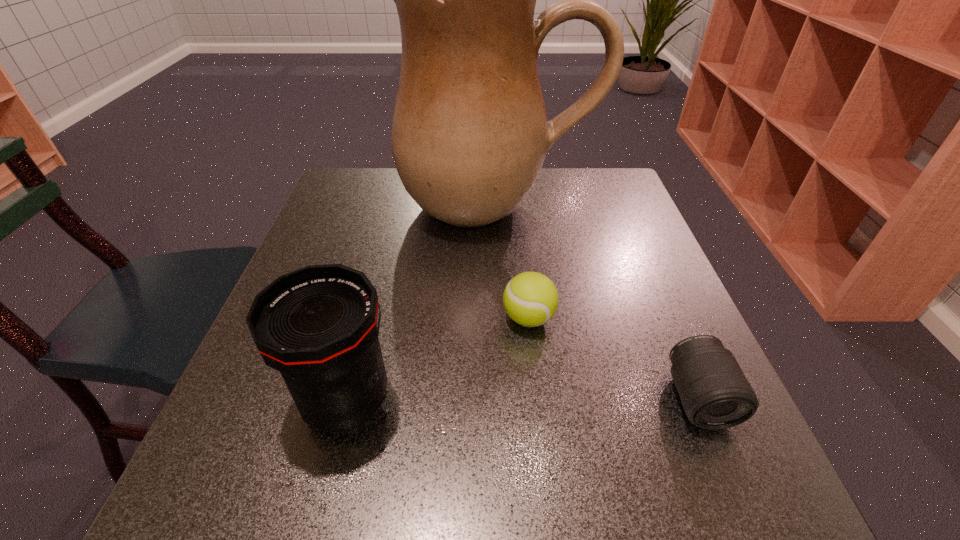
Identify the location of vacant position at the near right corner of the desktop. (750, 526).

The image size is (960, 540). Identify the location of vacant area between the tallest object and the left telephoto lens. (421, 303).

In order to click on free space between the tennis ball and the tallest object in this screenshot , I will do click(513, 262).

This screenshot has width=960, height=540. I want to click on free spot between the tennis ball and the shorter telephoto lens, so click(x=613, y=358).

Where is `vacant area between the left telephoto lens and the right telephoto lens`? vacant area between the left telephoto lens and the right telephoto lens is located at coordinates (522, 399).

I want to click on free spot between the tallest object and the tennis ball, so click(x=513, y=262).

Where is `free space that is in between the shorter telephoto lens and the second tallest object`? Image resolution: width=960 pixels, height=540 pixels. free space that is in between the shorter telephoto lens and the second tallest object is located at coordinates (522, 399).

The width and height of the screenshot is (960, 540). I want to click on free spot between the tennis ball and the third shortest object, so click(x=438, y=360).

Identify the location of empty location between the tennis ball and the farthest object. (513, 262).

Identify the location of free space between the farthest object and the tennis ball. (513, 262).